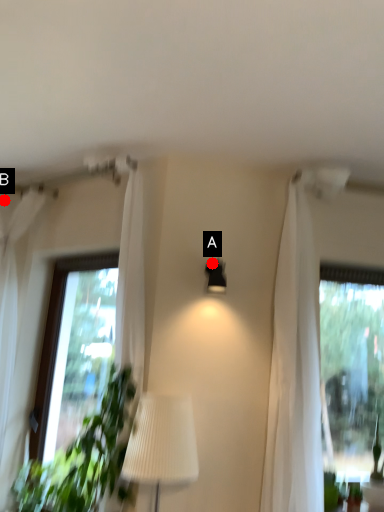
Question: Two points are circled on the image, labeled by A and B beside each circle. Among these points, which one is farthest from the camera?

Choices:
 (A) A is further
 (B) B is further

Answer: (B)